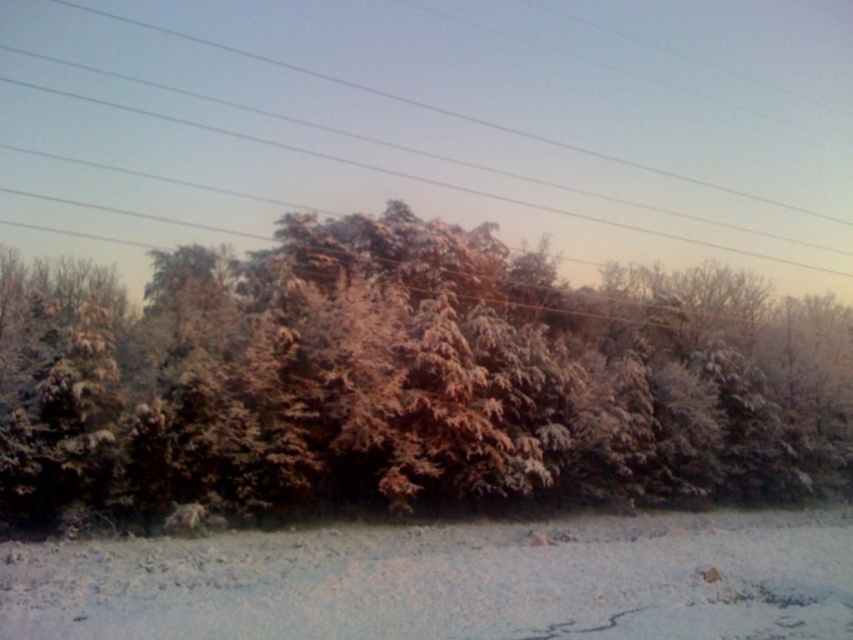
Question: Among these objects, which one is nearest to the camera?

Choices:
 (A) smooth wire at upper center
 (B) white frosty trees at center

Answer: (B)

Question: Is white frosty trees at center further to camera compared to smooth wire at upper center?

Choices:
 (A) yes
 (B) no

Answer: (B)

Question: Where is white frosty trees at center located in relation to smooth wire at upper center in the image?

Choices:
 (A) right
 (B) left

Answer: (A)

Question: Is white frosty trees at center below smooth wire at upper center?

Choices:
 (A) no
 (B) yes

Answer: (B)

Question: Which point is closer to the camera?

Choices:
 (A) white frosty trees at center
 (B) smooth wire at upper center

Answer: (A)